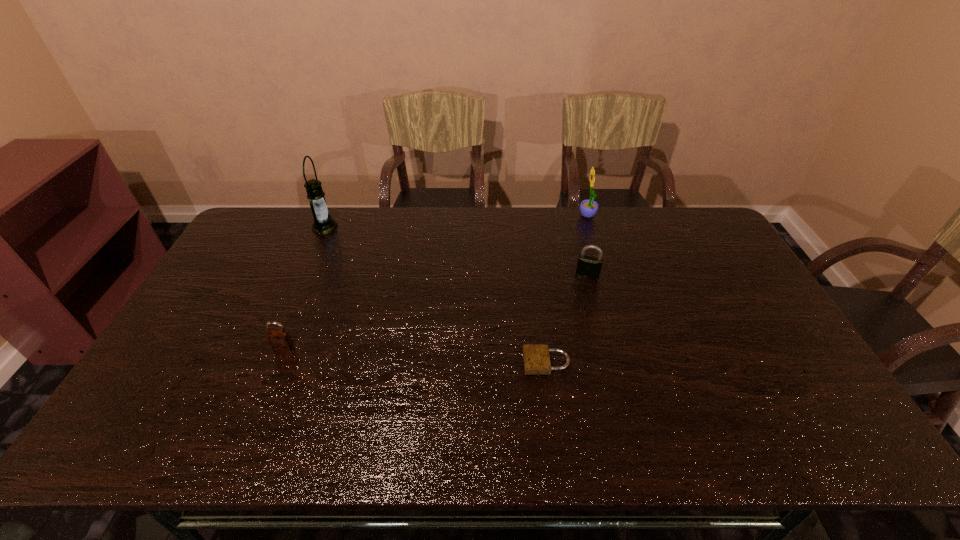
Where is `free region at the left edge`? The height and width of the screenshot is (540, 960). free region at the left edge is located at coordinates (198, 335).

The image size is (960, 540). Find the location of `free space at the right edge of the desktop`. free space at the right edge of the desktop is located at coordinates (782, 389).

Where is `vacant space at the far left corner of the desktop`? vacant space at the far left corner of the desktop is located at coordinates (287, 234).

Find the location of a particular element. free spot at the far right corner of the desktop is located at coordinates (703, 236).

In the image, there is a desktop. At what (x,y) coordinates should I click in order to perform the action: click on blank space at the near right corner. Please return your answer as a coordinate pair (x, y). Looking at the image, I should click on (825, 427).

Where is `vacant point located between the lantern and the leftmost padlock`? vacant point located between the lantern and the leftmost padlock is located at coordinates (304, 287).

This screenshot has width=960, height=540. I want to click on empty space between the third nearest object and the shortest padlock, so click(566, 318).

Find the location of a particular element. free space that is in between the rightmost padlock and the leftmost padlock is located at coordinates (436, 310).

Where is `free spot between the leftmost padlock and the rightmost padlock`? The width and height of the screenshot is (960, 540). free spot between the leftmost padlock and the rightmost padlock is located at coordinates (436, 310).

At what (x,y) coordinates should I click in order to perform the action: click on unoccupied area between the third farthest object and the leftmost padlock. Please return your answer as a coordinate pair (x, y). The image size is (960, 540). Looking at the image, I should click on (436, 310).